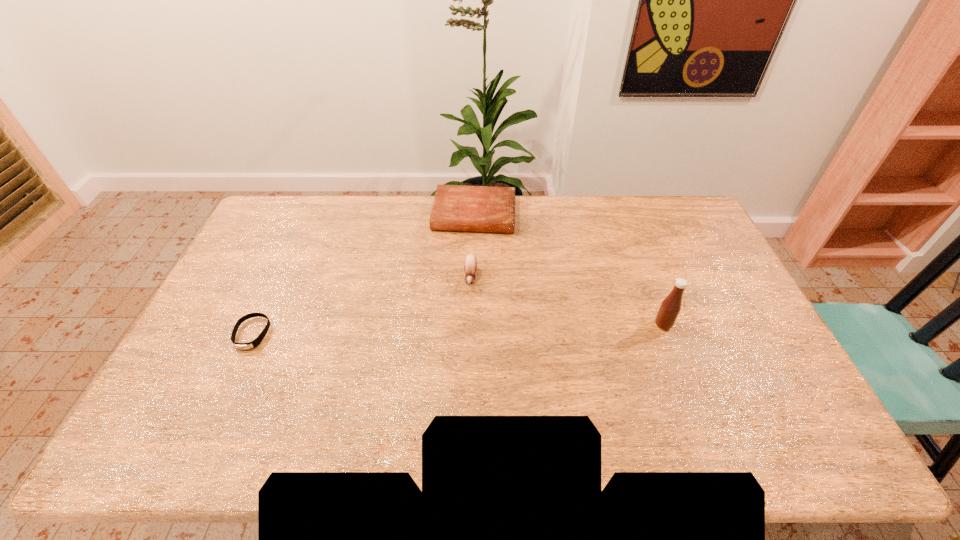
This screenshot has height=540, width=960. In order to click on vacant space that's between the third tallest object and the escargot in this screenshot , I will do `click(472, 246)`.

Image resolution: width=960 pixels, height=540 pixels. Identify the location of empty space that is in between the Tabasco sauce and the third tallest object. tap(568, 269).

You are a GUI agent. You are given a task and a screenshot of the screen. Output one action in this format:
    pyautogui.click(x=<x>, y=<y>)
    Task: Click on the vacant space that is in between the tallest object and the wristband
    This screenshot has height=540, width=960.
    Given the screenshot: What is the action you would take?
    pyautogui.click(x=458, y=329)

Where is `the third closest object to the second farthest object`? The image size is (960, 540). the third closest object to the second farthest object is located at coordinates (250, 345).

Locate an element on the screen. object that can be found as the second closest to the wristband is located at coordinates (456, 207).